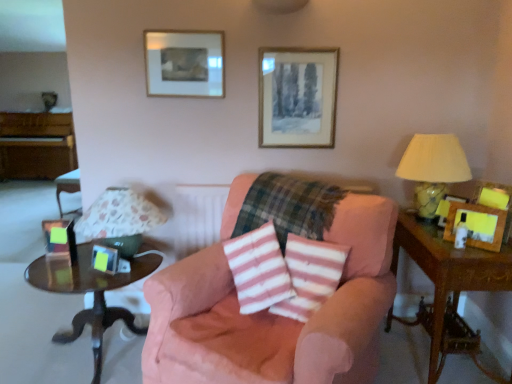
Question: Can you confirm if wooden piano at left is smaller than pink striped fabric at center?

Choices:
 (A) yes
 (B) no

Answer: (B)

Question: From the image's perspective, is wooden piano at left over pink striped fabric at center?

Choices:
 (A) no
 (B) yes

Answer: (B)

Question: Considering the relative sizes of wooden piano at left and pink striped fabric at center in the image provided, is wooden piano at left bigger than pink striped fabric at center?

Choices:
 (A) yes
 (B) no

Answer: (A)

Question: Is wooden piano at left taller than pink striped fabric at center?

Choices:
 (A) yes
 (B) no

Answer: (A)

Question: From the image's perspective, is wooden piano at left below pink striped fabric at center?

Choices:
 (A) yes
 (B) no

Answer: (B)

Question: From a real-world perspective, does wooden piano at left sit lower than pink striped fabric at center?

Choices:
 (A) no
 (B) yes

Answer: (B)

Question: From the image's perspective, does pink fabric chair at center appear lower than gold-framed picture at upper center, the second picture frame in the back-to-front sequence?

Choices:
 (A) no
 (B) yes

Answer: (B)

Question: Is pink fabric chair at center outside gold-framed picture at upper center, arranged as the 4th picture frame when viewed from the front?

Choices:
 (A) no
 (B) yes

Answer: (B)

Question: Is pink fabric chair at center aimed at gold-framed picture at upper center, the second picture frame in the back-to-front sequence?

Choices:
 (A) yes
 (B) no

Answer: (B)

Question: Considering the relative positions of pink fabric chair at center and gold-framed picture at upper center, marked as the second picture frame in a top-to-bottom arrangement, in the image provided, is pink fabric chair at center to the left of gold-framed picture at upper center, marked as the second picture frame in a top-to-bottom arrangement, from the viewer's perspective?

Choices:
 (A) yes
 (B) no

Answer: (A)

Question: Is pink fabric chair at center turned away from gold-framed picture at upper center, arranged as the 4th picture frame when viewed from the front?

Choices:
 (A) yes
 (B) no

Answer: (B)

Question: Can you confirm if pink fabric chair at center is bigger than gold-framed picture at upper center, the second picture frame in the back-to-front sequence?

Choices:
 (A) no
 (B) yes

Answer: (B)

Question: Is wooden picture frame at right, placed as the fifth picture frame when sorted from left to right, thinner than pink striped fabric at center?

Choices:
 (A) no
 (B) yes

Answer: (B)